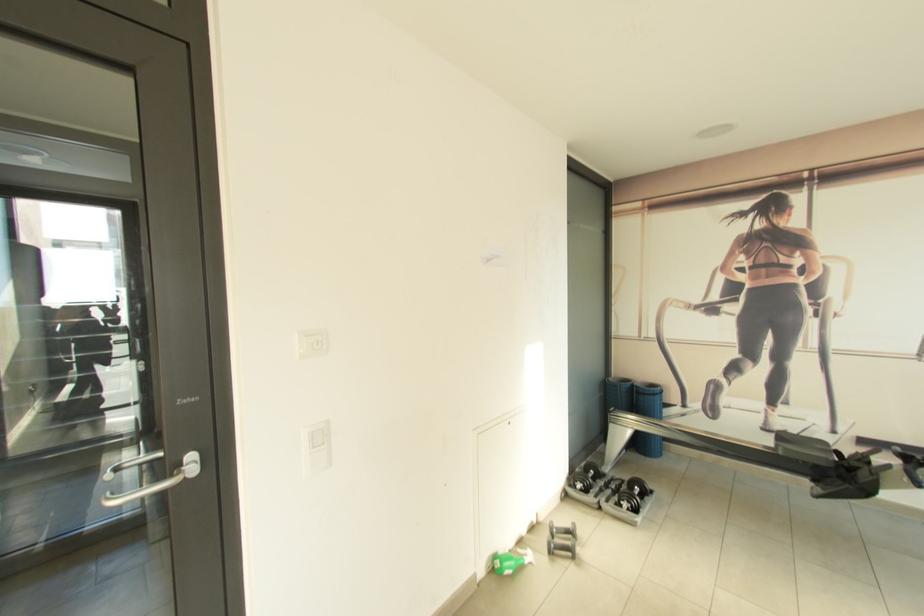
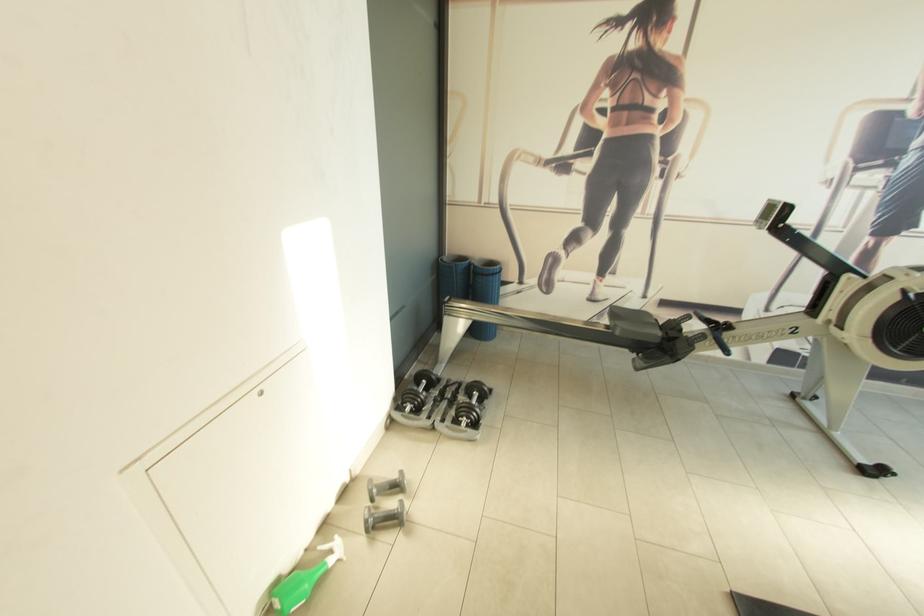
Where in the second image is the point corresponding to [615,381] from the first image?

(451, 261)